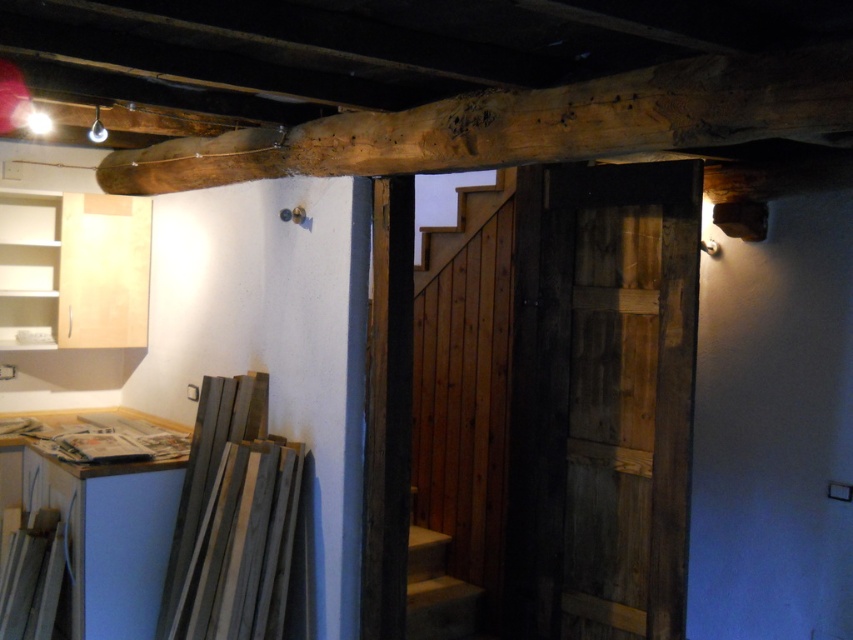
Question: Can you confirm if natural wood beam at upper center is positioned to the left of smooth concrete stairs at center?

Choices:
 (A) yes
 (B) no

Answer: (A)

Question: Which of the following is the closest to the observer?

Choices:
 (A) (218, 609)
 (B) (221, 172)
 (C) (463, 596)

Answer: (A)

Question: Does gray matte wood at lower left have a greater width compared to smooth concrete stairs at center?

Choices:
 (A) no
 (B) yes

Answer: (B)

Question: Which of the following is the farthest from the observer?

Choices:
 (A) (167, 189)
 (B) (267, 449)
 (C) (421, 600)

Answer: (A)

Question: Which of these objects is positioned farthest from the smooth concrete stairs at center?

Choices:
 (A) gray matte wood at lower left
 (B) natural wood beam at upper center

Answer: (B)

Question: Is natural wood beam at upper center to the right of gray matte wood at lower left from the viewer's perspective?

Choices:
 (A) no
 (B) yes

Answer: (B)